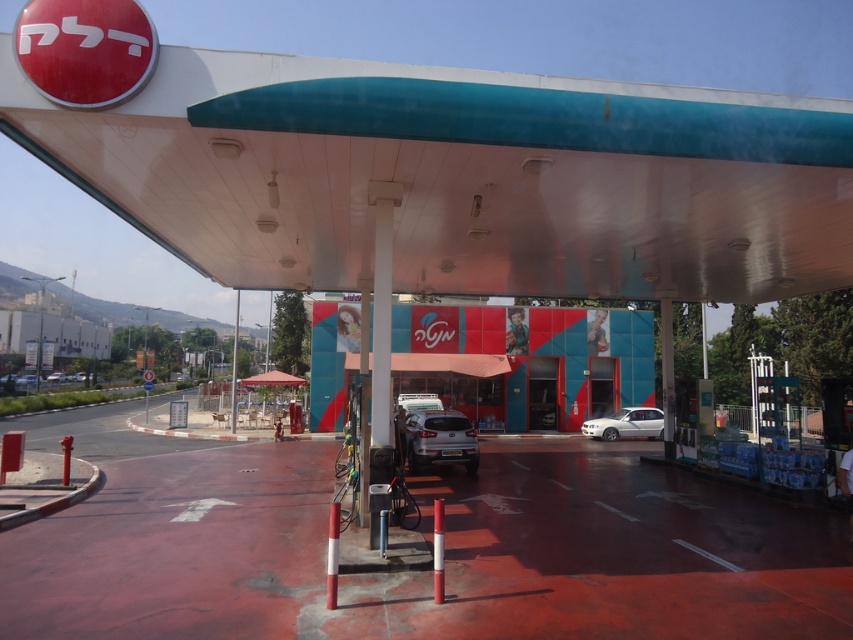
Question: Which object is the farthest from the satin silver sedan at center?

Choices:
 (A) satin silver suv at center
 (B) white metallic car at center

Answer: (B)

Question: Which point is farther to the camera?

Choices:
 (A) satin silver sedan at center
 (B) matte plastic gas station at center
 (C) satin silver suv at center

Answer: (A)

Question: Does matte plastic gas station at center have a smaller size compared to satin silver suv at center?

Choices:
 (A) no
 (B) yes

Answer: (A)

Question: Which of the following is the farthest from the observer?

Choices:
 (A) (460, 452)
 (B) (403, 394)
 (C) (611, 436)

Answer: (B)

Question: Does matte plastic gas station at center have a smaller size compared to white metallic car at center?

Choices:
 (A) yes
 (B) no

Answer: (B)

Question: From the image, what is the correct spatial relationship of satin silver suv at center in relation to white metallic car at center?

Choices:
 (A) above
 (B) below

Answer: (A)